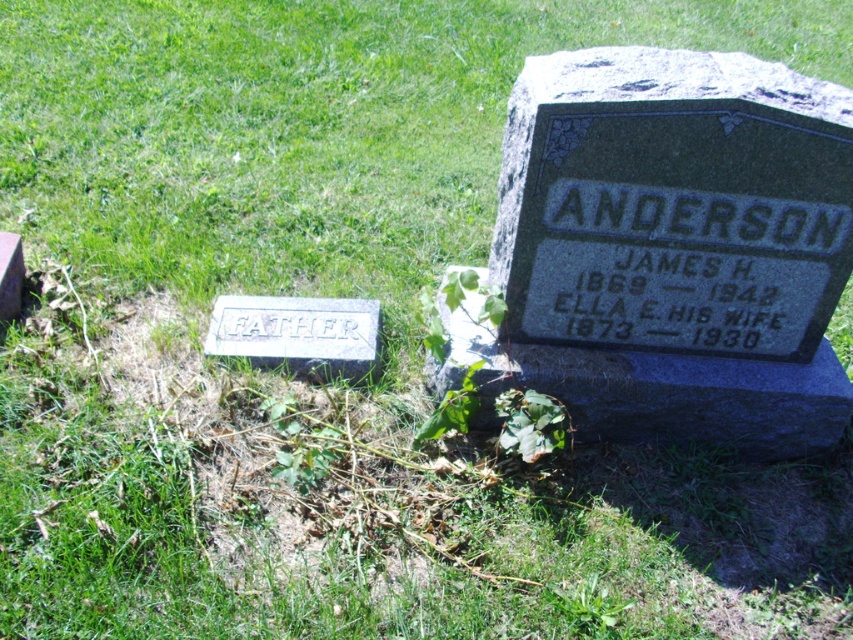
You are standing at the point marked by the coordinates point (297,333) in the cemetery scene. Which gravestone are you closest to?

The point (297,333) is on white stone at lower left, so you are closest to the white stone at lower left.

You are a gardener who needs to place a new flowerpot between the white stone at lower left and the green leafy weed at center. Based on their widths, can you estimate if there will be enough space for the flowerpot?

The white stone at lower left might be wider than green leafy weed at center, so there may not be enough space for the flowerpot between them.

You are a groundskeeper in the cemetery. You notice the green leafy weed at center and the white stone at lower left. Which object is closer to you as you stand in front of the cemetery section?

The white stone at lower left is closer to you because the green leafy weed at center is behind it.